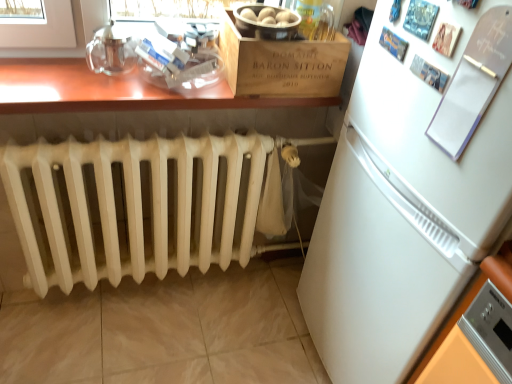
Question: Can you confirm if white matte refrigerator at right is wider than white paperboard at upper right?

Choices:
 (A) no
 (B) yes

Answer: (B)

Question: From the image's perspective, is white matte refrigerator at right on top of white paperboard at upper right?

Choices:
 (A) yes
 (B) no

Answer: (B)

Question: Is white matte refrigerator at right bigger than white paperboard at upper right?

Choices:
 (A) yes
 (B) no

Answer: (A)

Question: Does white matte refrigerator at right have a lesser height compared to white paperboard at upper right?

Choices:
 (A) no
 (B) yes

Answer: (A)

Question: Does white matte refrigerator at right come behind white paperboard at upper right?

Choices:
 (A) yes
 (B) no

Answer: (B)

Question: In the image, is white paperboard at upper right positioned in front of or behind white painted radiator at lower left?

Choices:
 (A) front
 (B) behind

Answer: (A)

Question: In terms of size, does white paperboard at upper right appear bigger or smaller than white painted radiator at lower left?

Choices:
 (A) big
 (B) small

Answer: (B)

Question: In terms of height, does white paperboard at upper right look taller or shorter compared to white painted radiator at lower left?

Choices:
 (A) short
 (B) tall

Answer: (A)

Question: From a real-world perspective, is white paperboard at upper right above or below white painted radiator at lower left?

Choices:
 (A) below
 (B) above

Answer: (B)

Question: Is white matte refrigerator at right wider or thinner than white paperboard at upper right?

Choices:
 (A) wide
 (B) thin

Answer: (A)

Question: Is white matte refrigerator at right spatially inside white paperboard at upper right, or outside of it?

Choices:
 (A) outside
 (B) inside

Answer: (A)

Question: In terms of height, does white matte refrigerator at right look taller or shorter compared to white paperboard at upper right?

Choices:
 (A) tall
 (B) short

Answer: (A)

Question: From a real-world perspective, is white matte refrigerator at right physically located above or below white paperboard at upper right?

Choices:
 (A) below
 (B) above

Answer: (A)

Question: In terms of size, does wooden table at upper center appear bigger or smaller than white paperboard at upper right?

Choices:
 (A) small
 (B) big

Answer: (B)

Question: In the image, is wooden table at upper center on the left side or the right side of white paperboard at upper right?

Choices:
 (A) right
 (B) left

Answer: (B)